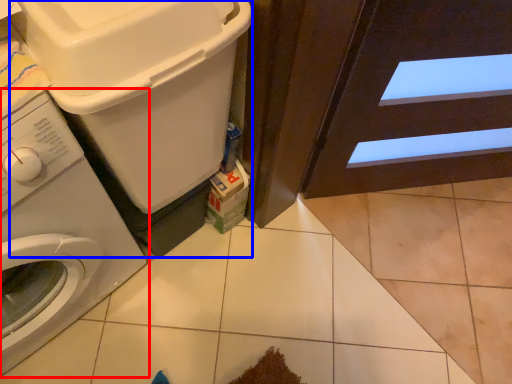
Question: Among these objects, which one is farthest to the camera, washing machine (highlighted by a red box) or washing machine (highlighted by a blue box)?

Choices:
 (A) washing machine
 (B) washing machine

Answer: (B)